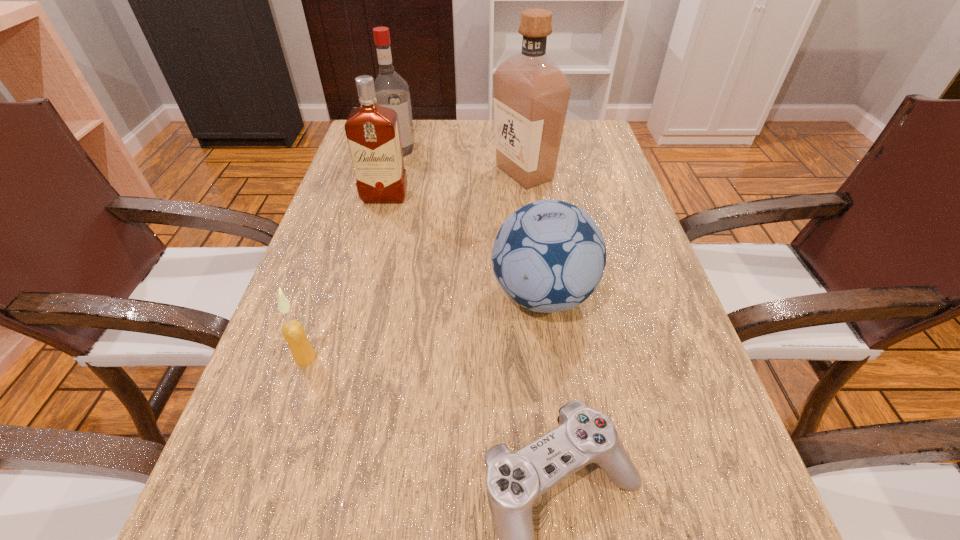
At what (x,y) coordinates should I click in order to perform the action: click on vacant space at the far right corner of the desktop. Please return your answer as a coordinate pair (x, y). Looking at the image, I should click on (582, 129).

Where is `vacant area between the third nearest object and the second shortest object`? vacant area between the third nearest object and the second shortest object is located at coordinates (424, 327).

What are the coordinates of `object that is the second closest to the shortest object` in the screenshot? It's located at 293,331.

The image size is (960, 540). Find the location of `object that stands as the closest to the fifth farthest object`. object that stands as the closest to the fifth farthest object is located at coordinates (549, 256).

This screenshot has height=540, width=960. Find the location of `liquor that is the second closest one to the tallest liquor`. liquor that is the second closest one to the tallest liquor is located at coordinates (392, 91).

Identify the location of liquor that is the second closest to the fourth farthest object. (372, 131).